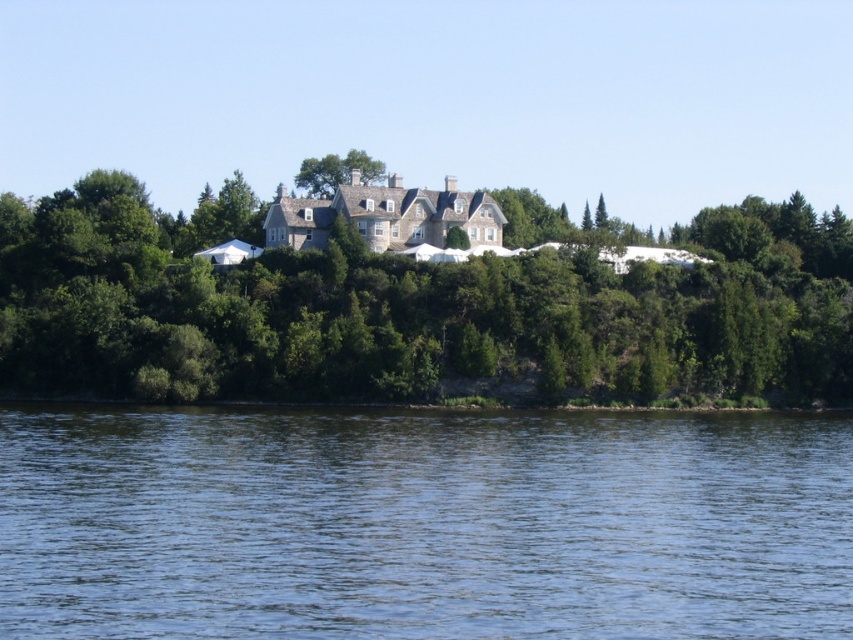
Question: Among these objects, which one is nearest to the camera?

Choices:
 (A) green leafy tree at center
 (B) blue liquid water at lower center
 (C) green leafy tree at upper center

Answer: (B)

Question: Where is blue liquid water at lower center located in relation to green leafy tree at center in the image?

Choices:
 (A) below
 (B) above

Answer: (A)

Question: Considering the real-world distances, which object is closest to the green leafy tree at center?

Choices:
 (A) green leafy tree at upper center
 (B) blue liquid water at lower center

Answer: (A)

Question: Does blue liquid water at lower center have a greater width compared to green leafy tree at center?

Choices:
 (A) no
 (B) yes

Answer: (A)

Question: Which object is closer to the camera taking this photo?

Choices:
 (A) green leafy tree at center
 (B) blue liquid water at lower center

Answer: (B)

Question: Is green leafy tree at center to the left of green leafy tree at upper center from the viewer's perspective?

Choices:
 (A) no
 (B) yes

Answer: (A)